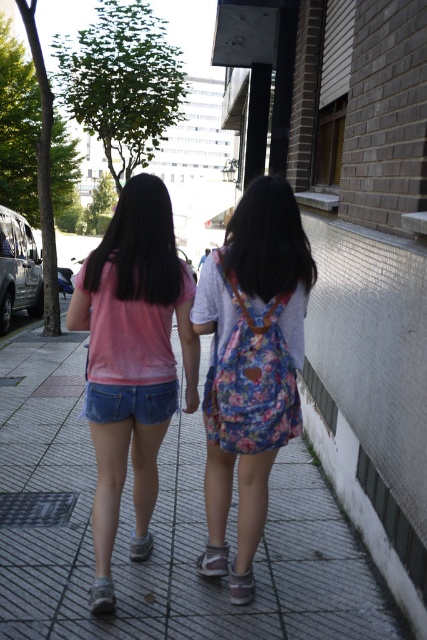
Question: Among these objects, which one is nearest to the camera?

Choices:
 (A) denim shorts at center
 (B) white fabric sandal at center
 (C) pink denim shorts at center
 (D) floral fabric backpack at center

Answer: (C)

Question: Is floral fabric backpack at center below pink denim shorts at center?

Choices:
 (A) yes
 (B) no

Answer: (B)

Question: Can you confirm if denim shorts at center is smaller than brown suede sandal at lower center?

Choices:
 (A) yes
 (B) no

Answer: (B)

Question: Is floral fabric backpack at center closer to camera compared to white fabric sandal at center?

Choices:
 (A) yes
 (B) no

Answer: (A)

Question: Which object is positioned closest to the brown suede sandal at lower center?

Choices:
 (A) white fabric sandal at center
 (B) denim shorts at center
 (C) floral fabric backpack at center
 (D) pink denim shorts at center

Answer: (A)

Question: Which of the following is the closest to the observer?

Choices:
 (A) (251, 296)
 (B) (245, 588)
 (C) (339, 516)

Answer: (A)